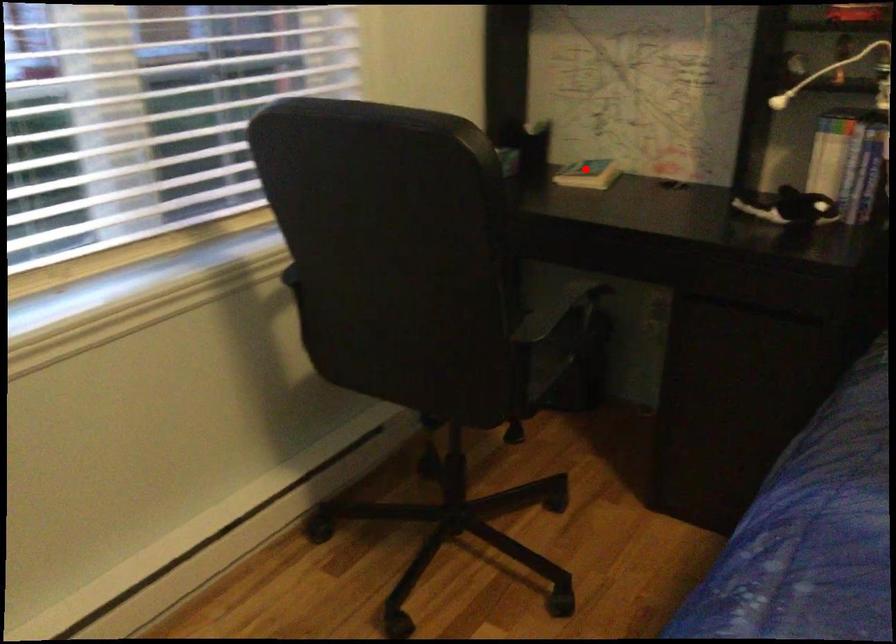
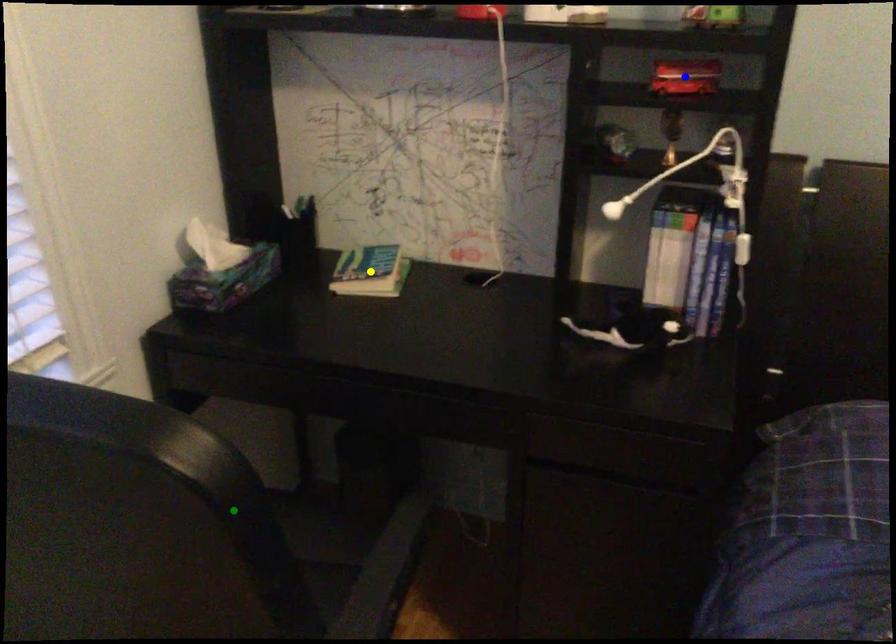
Question: I am providing you with two images of the same scene from different viewpoints. A red point is marked on the first image. You are given multiple points on the second image. Which point in image 2 represents the same 3d spot as the red point in image 1?

Choices:
 (A) blue point
 (B) green point
 (C) yellow point

Answer: (C)